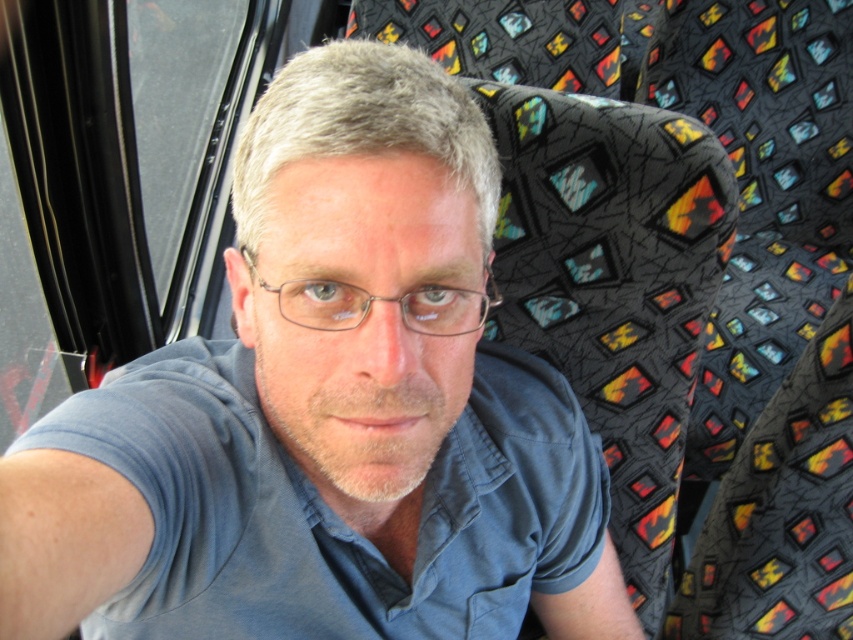
Is blue cotton shirt at center above clear plastic glasses at center?

No, blue cotton shirt at center is not above clear plastic glasses at center.

Which is above, blue cotton shirt at center or clear plastic glasses at center?

clear plastic glasses at center

Is point (314, 259) positioned in front of point (469, 292)?

Yes, it is.

Where is `blue cotton shirt at center`? blue cotton shirt at center is located at coordinates (326, 410).